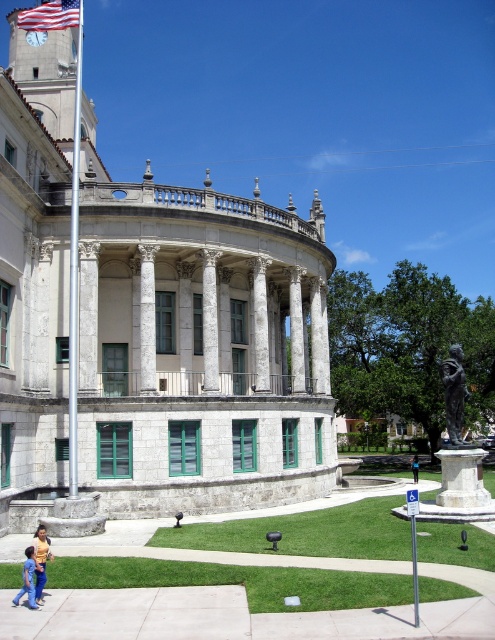
Between point (48, 540) and point (418, 467), which one is positioned in front?

Positioned in front is point (48, 540).

Can you confirm if blue jeans at lower left is thinner than blue fabric shirt at center?

Yes.

Is point (38, 580) positioned behind point (417, 460)?

No, (38, 580) is closer to viewer.

Identify the location of blue jeans at lower left. point(41,560).

Does polished metal flag pole at left appear over bronze statue at center?

Correct, polished metal flag pole at left is located above bronze statue at center.

Does polished metal flag pole at left appear on the right side of bronze statue at center?

No, polished metal flag pole at left is not to the right of bronze statue at center.

Is point (75, 300) positioned before point (460, 376)?

Yes.

Image resolution: width=495 pixels, height=640 pixels. What are the coordinates of `polished metal flag pole at left` in the screenshot? It's located at (75, 266).

In the scene shown: Does polished metal flag pole at left appear over white marble column at center?

Yes, polished metal flag pole at left is above white marble column at center.

Does polished metal flag pole at left appear on the right side of white marble column at center?

In fact, polished metal flag pole at left is to the left of white marble column at center.

This screenshot has height=640, width=495. In order to click on polished metal flag pole at left in this screenshot , I will do `click(75, 266)`.

This screenshot has height=640, width=495. I want to click on polished metal flag pole at left, so click(x=75, y=266).